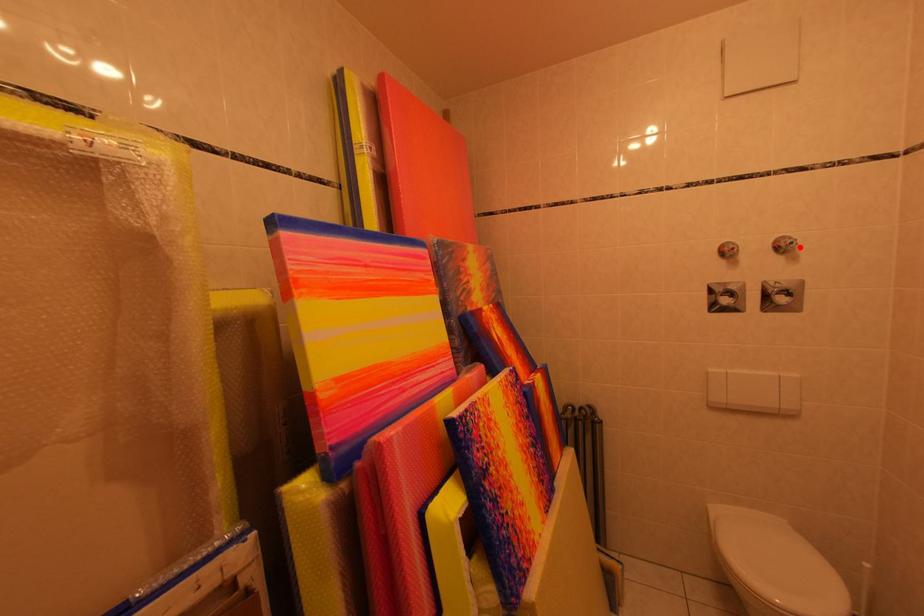
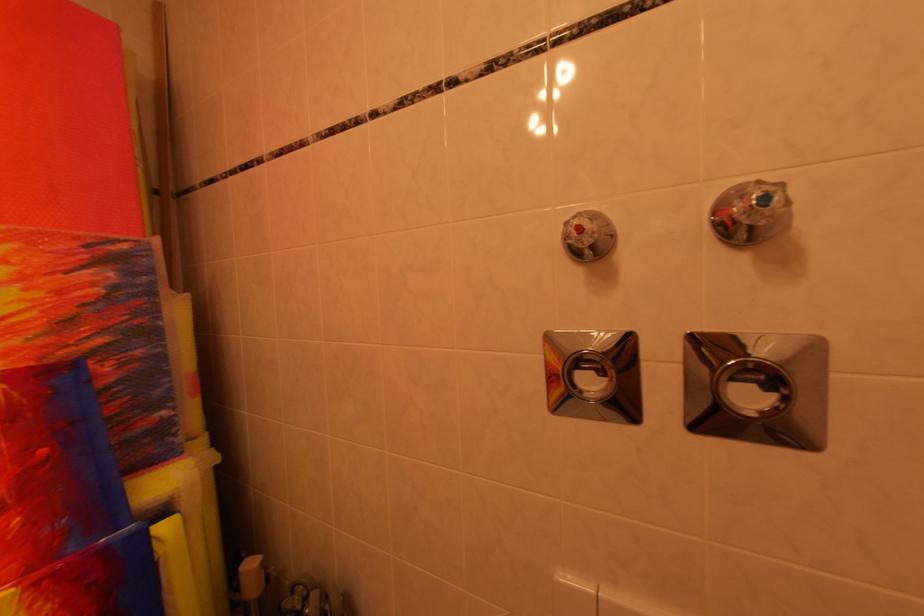
Locate, in the second image, the point that corresponds to the highlighted location in the first image.

(773, 201)